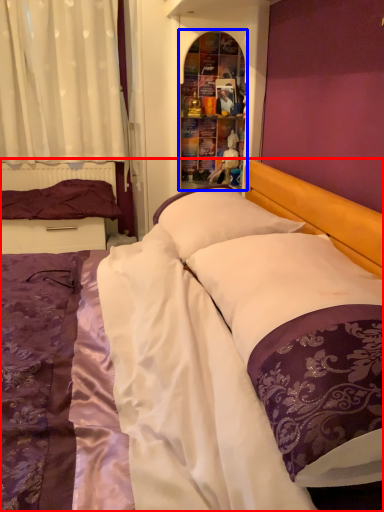
Question: Among these objects, which one is nearest to the camera, bed (highlighted by a red box) or shelf (highlighted by a blue box)?

Choices:
 (A) bed
 (B) shelf

Answer: (A)